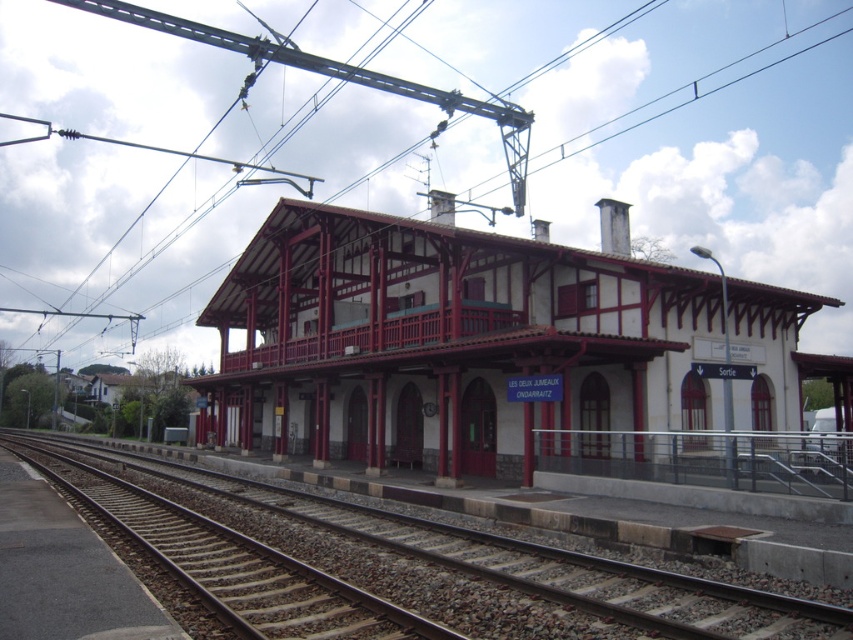
Question: Which object appears farthest from the camera in this image?

Choices:
 (A) white wood railway station at center
 (B) smooth gravel track at center

Answer: (A)

Question: Does smooth gravel track at center have a larger size compared to black metal railing at lower right?

Choices:
 (A) no
 (B) yes

Answer: (B)

Question: Is white wood railway station at center to the left of smooth gravel track at center from the viewer's perspective?

Choices:
 (A) no
 (B) yes

Answer: (A)

Question: Based on their relative distances, which object is farther from the white wood railway station at center?

Choices:
 (A) smooth gravel track at center
 (B) black metal railing at lower right

Answer: (B)

Question: Which point appears closest to the camera in this image?

Choices:
 (A) (326, 531)
 (B) (500, 330)

Answer: (A)

Question: Where is white wood railway station at center located in relation to black metal railing at lower right in the image?

Choices:
 (A) below
 (B) above

Answer: (B)